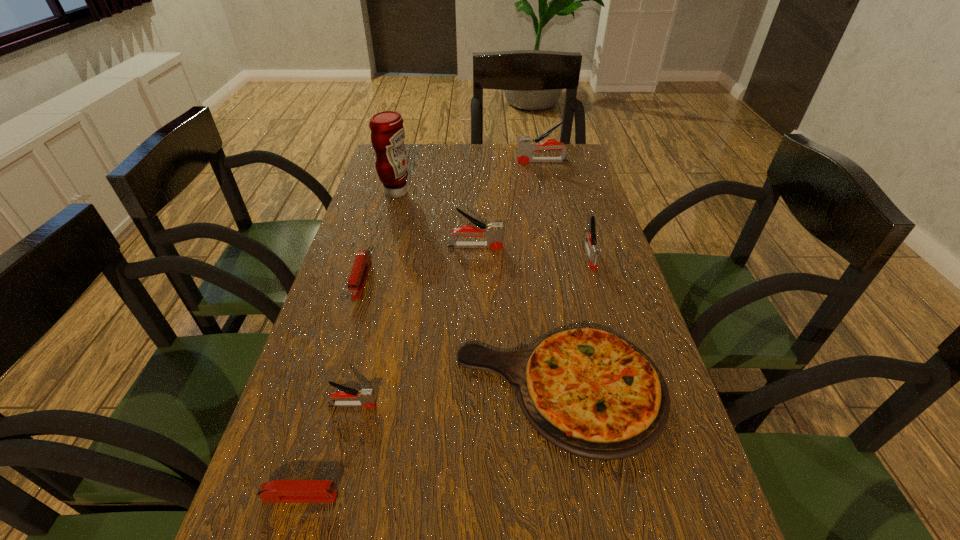
Where is `the closest object relative to the pizza`? Image resolution: width=960 pixels, height=540 pixels. the closest object relative to the pizza is located at coordinates (365, 397).

Point out which stapler is positioned as the sixth nearest to the seventh nearest object. Please provide its 2D coordinates. Your answer should be formatted as a tuple, i.e. [(x, y)], where the tuple contains the x and y coordinates of a point satisfying the conditions above.

[(276, 491)]

Locate an element on the screen. The width and height of the screenshot is (960, 540). stapler that is the nearest to the fifth shortest object is located at coordinates (493, 232).

The width and height of the screenshot is (960, 540). Find the location of `the second closest gray stapler to the farther red stapler`. the second closest gray stapler to the farther red stapler is located at coordinates (365, 397).

Where is `gray stapler that is the third closest to the third stapler from right to left`? This screenshot has height=540, width=960. gray stapler that is the third closest to the third stapler from right to left is located at coordinates (365, 397).

Locate an element on the screen. red stapler that is the closest one to the seventh shortest object is located at coordinates (357, 280).

Where is `red stapler object that ranks as the closest to the fourth tallest stapler`? This screenshot has width=960, height=540. red stapler object that ranks as the closest to the fourth tallest stapler is located at coordinates (276, 491).